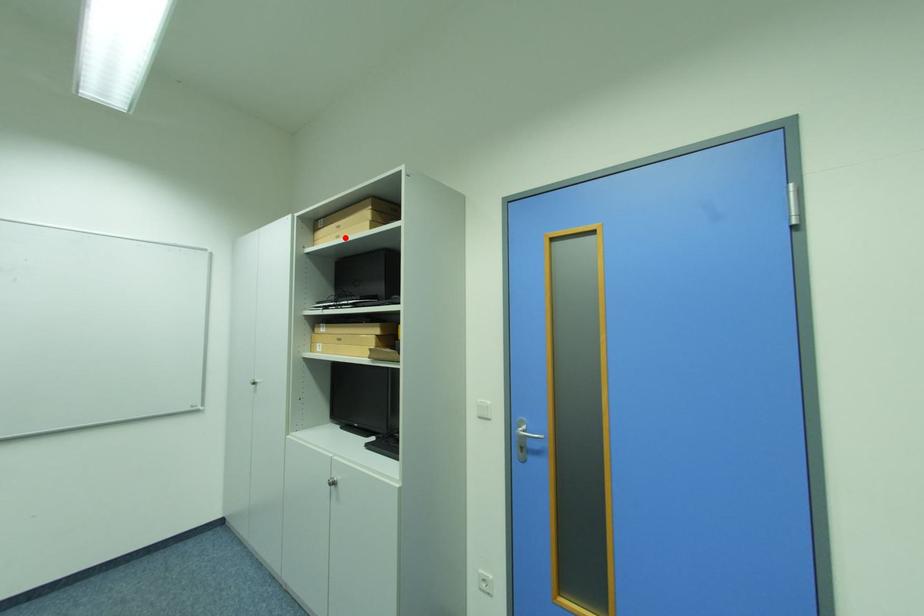
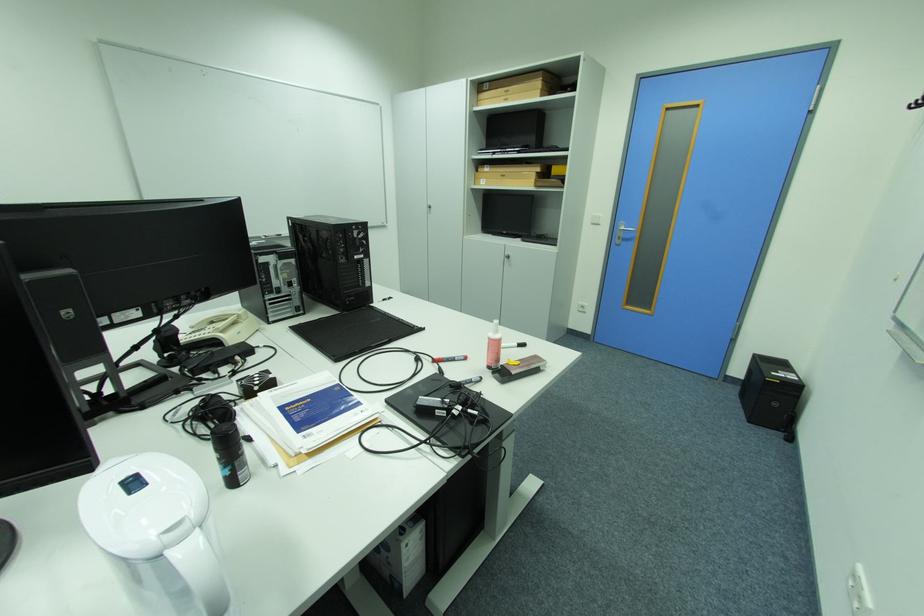
Question: I am providing you with two images of the same scene from different viewpoints. A red point is marked on the first image. At the location where the point appears in image 1, is it still visible in image 2?

Choices:
 (A) Yes
 (B) No

Answer: (A)